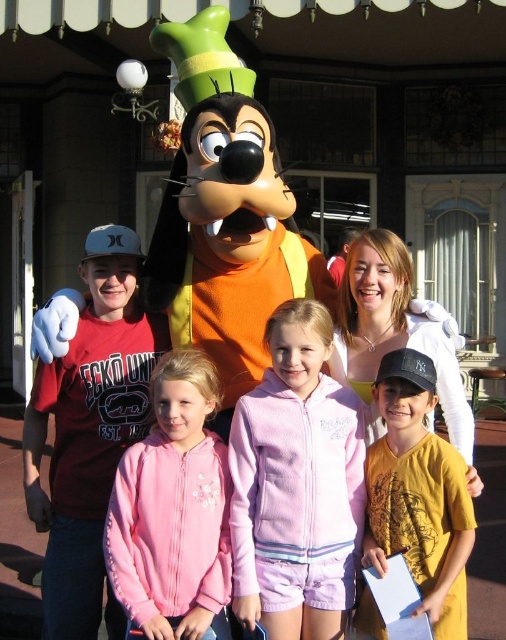
Looking at the photo of the group with the Goofy mascot, which clothing item is positioned to the right of the other between the pink fleece hoodie at center and the pink fleece jacket at center?

The pink fleece hoodie at center is positioned to the right of the pink fleece jacket at center.

You are a photographer trying to adjust the lighting for a group photo. You notice the pink fleece jacket at center and the yellow cotton shirt at center. Which clothing item is closer to the camera?

The yellow cotton shirt at center is closer to the camera because the pink fleece jacket at center is positioned under it.